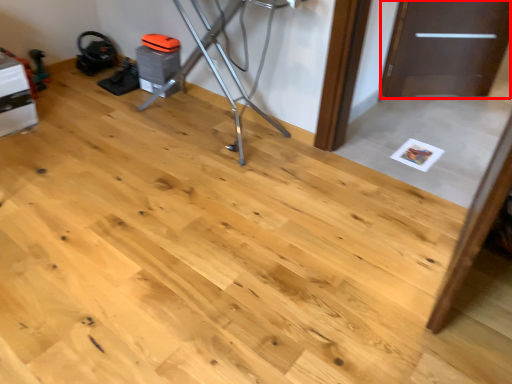
Question: From the image's perspective, what is the correct spatial positioning of door (annotated by the red box) in reference to furniture?

Choices:
 (A) above
 (B) below

Answer: (A)